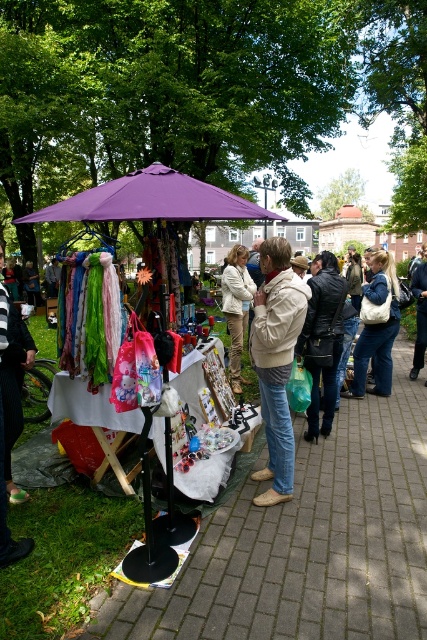
Question: Which of the following is the closest to the observer?

Choices:
 (A) (379, 296)
 (B) (268, 380)
 (C) (327, 252)

Answer: (B)

Question: Which point appears closest to the camera in this image?

Choices:
 (A) (228, 202)
 (B) (406, 440)
 (C) (248, 276)
 (D) (388, 284)

Answer: (A)

Question: Where is purple fabric umbrella at center located in relation to leather jacket at center in the image?

Choices:
 (A) below
 (B) above

Answer: (B)

Question: Where is matte plastic bag at center located in relation to purple fabric umbrella at center in the image?

Choices:
 (A) left
 (B) right

Answer: (B)

Question: Which object is closer to the camera taking this photo?

Choices:
 (A) white leather bag at right
 (B) light beige jacket at center
 (C) matte plastic bag at center
 (D) leather jacket at center

Answer: (C)

Question: Is purple fabric umbrella at center closer to the viewer compared to white leather bag at right?

Choices:
 (A) yes
 (B) no

Answer: (A)